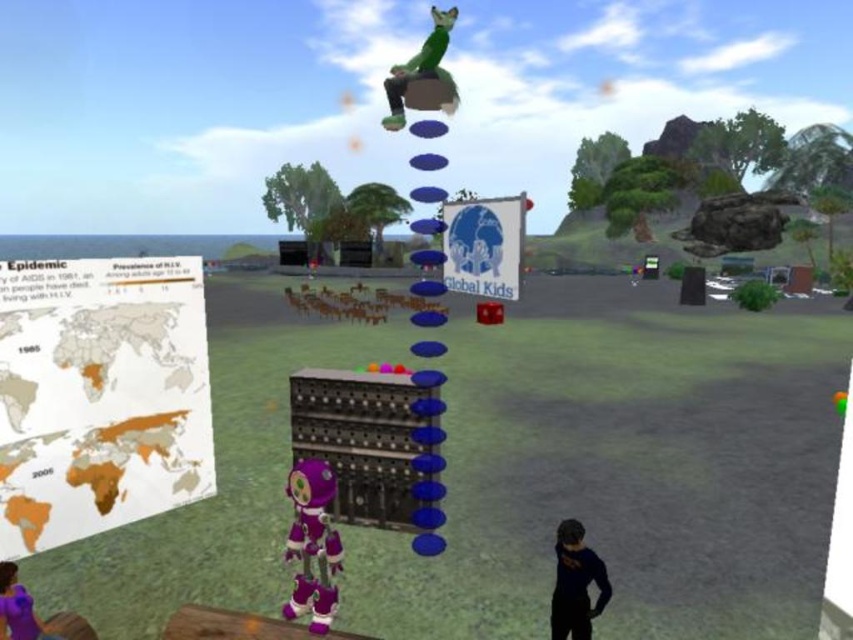
Can you confirm if brown matte horse at center is smaller than purple fabric person at lower left?

Incorrect, brown matte horse at center is not smaller in size than purple fabric person at lower left.

Can you confirm if brown matte horse at center is positioned below purple fabric person at lower left?

Actually, brown matte horse at center is above purple fabric person at lower left.

Does point (283, 289) come farther from viewer compared to point (18, 582)?

Yes, point (283, 289) is behind point (18, 582).

Where is `brown matte horse at center`? brown matte horse at center is located at coordinates (357, 301).

Is dark blue fabric shirt at lower right to the right of brown matte horse at center from the viewer's perspective?

Yes, dark blue fabric shirt at lower right is to the right of brown matte horse at center.

Does dark blue fabric shirt at lower right have a smaller size compared to brown matte horse at center?

Yes.

Who is more forward, (561,630) or (344,316)?

Point (561,630) is in front.

Locate an element on the screen. dark blue fabric shirt at lower right is located at coordinates (575, 582).

Find the location of `dark blue fabric shirt at lower right`. dark blue fabric shirt at lower right is located at coordinates (575, 582).

Who is higher up, dark blue fabric shirt at lower right or green matte fur at upper center?

green matte fur at upper center is higher up.

Locate an element on the screen. Image resolution: width=853 pixels, height=640 pixels. dark blue fabric shirt at lower right is located at coordinates (575, 582).